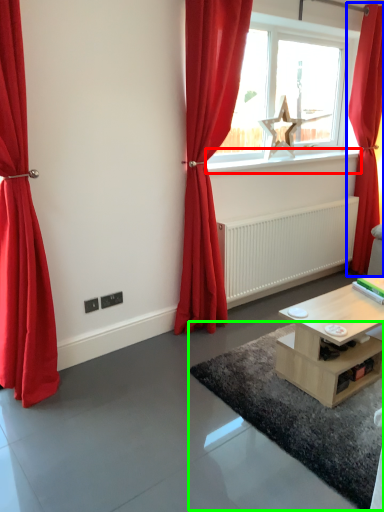
Question: Considering the real-world distances, which object is farthest from window sill (highlighted by a red box)? curtain (highlighted by a blue box) or plain (highlighted by a green box)?

Choices:
 (A) curtain
 (B) plain

Answer: (B)